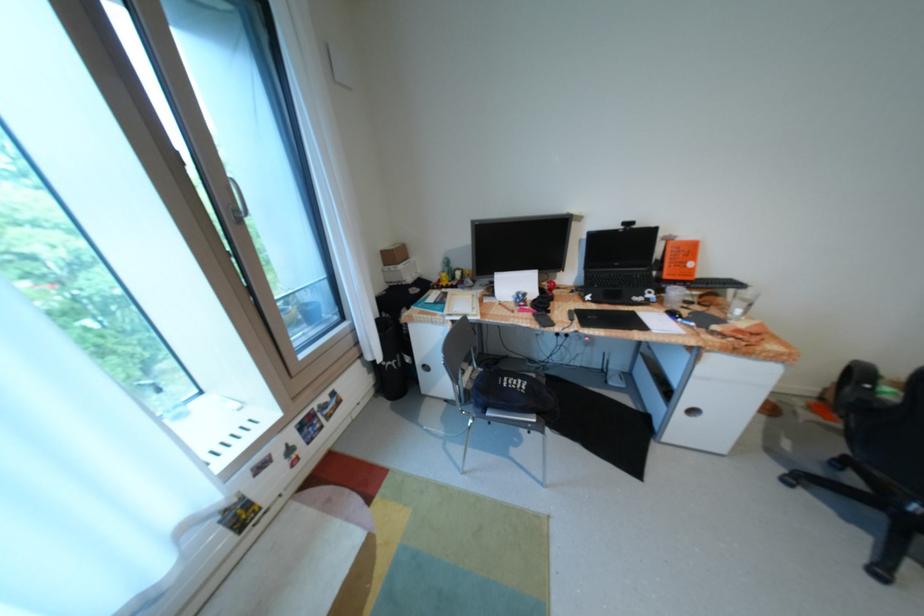
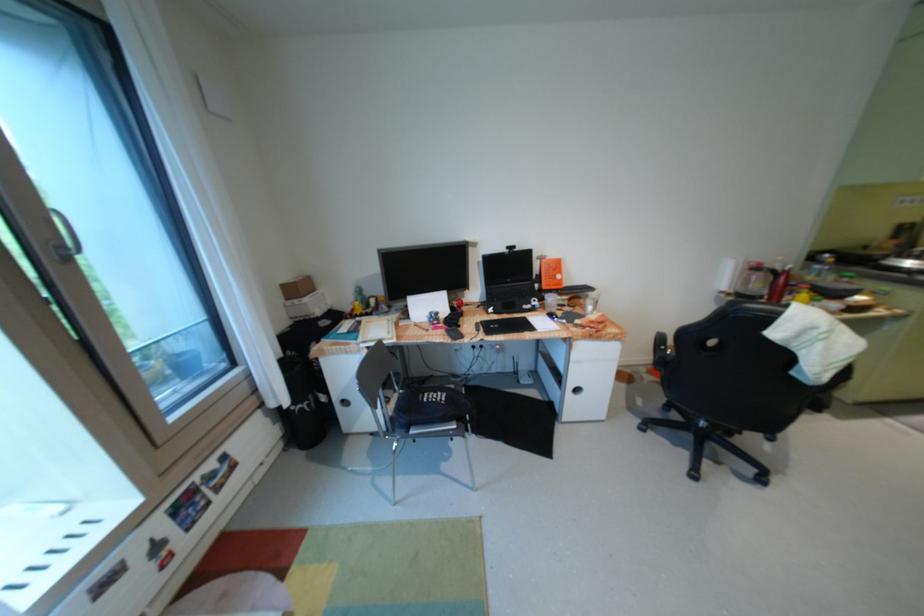
Question: The camera is either moving clockwise (left) or counter-clockwise (right) around the object. The first image is from the beginning of the video and the second image is from the end. Is the camera moving left or right when shooting the video?

Choices:
 (A) Left
 (B) Right

Answer: (A)